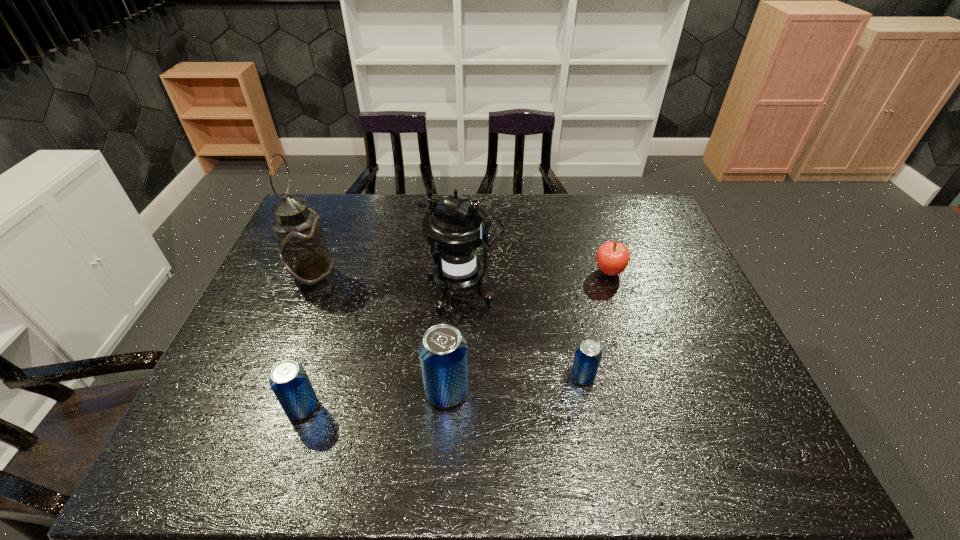
The width and height of the screenshot is (960, 540). Find the location of `vacant area located on the right of the tallest beer can`. vacant area located on the right of the tallest beer can is located at coordinates (619, 392).

At what (x,y) coordinates should I click in order to perform the action: click on free space located on the right of the second object from right to left. Please return your answer as a coordinate pair (x, y). Looking at the image, I should click on (720, 376).

Where is `vacant region located 0.170m on the right of the oil lamp`? The width and height of the screenshot is (960, 540). vacant region located 0.170m on the right of the oil lamp is located at coordinates (394, 279).

Locate an element on the screen. This screenshot has height=540, width=960. vacant region located on the back of the apple is located at coordinates (585, 195).

Image resolution: width=960 pixels, height=540 pixels. I want to click on vacant space situated on the left of the second tallest object, so click(x=283, y=293).

What are the coordinates of `object situated at the left edge` in the screenshot? It's located at (303, 250).

Image resolution: width=960 pixels, height=540 pixels. What are the coordinates of `free space at the far edge of the desktop` in the screenshot? It's located at (363, 230).

Image resolution: width=960 pixels, height=540 pixels. I want to click on vacant space at the near edge of the desktop, so click(401, 388).

Find the location of a particular element. vacant space at the left edge is located at coordinates (279, 325).

Locate an element on the screen. vacant space at the right edge of the desktop is located at coordinates (697, 340).